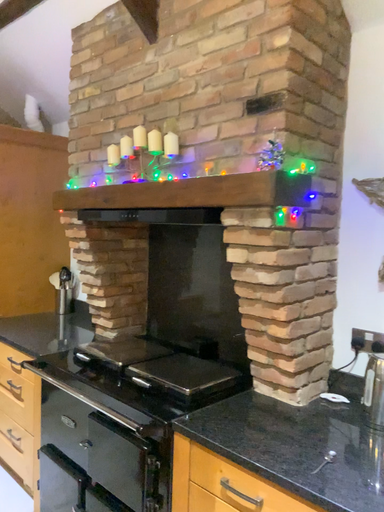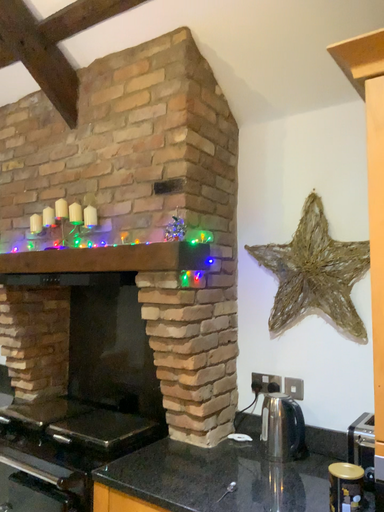
Question: How did the camera likely rotate when shooting the video?

Choices:
 (A) rotated right
 (B) rotated left

Answer: (A)